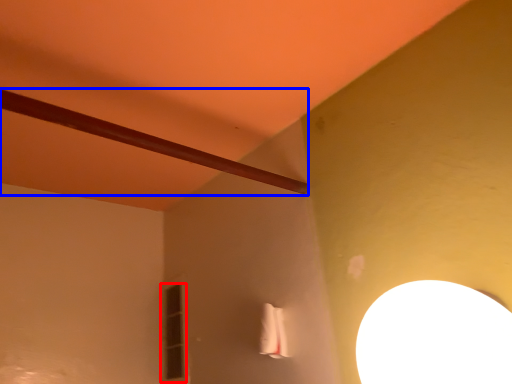
Question: Which object appears farthest to the camera in this image, window (highlighted by a red box) or beam (highlighted by a blue box)?

Choices:
 (A) window
 (B) beam

Answer: (A)